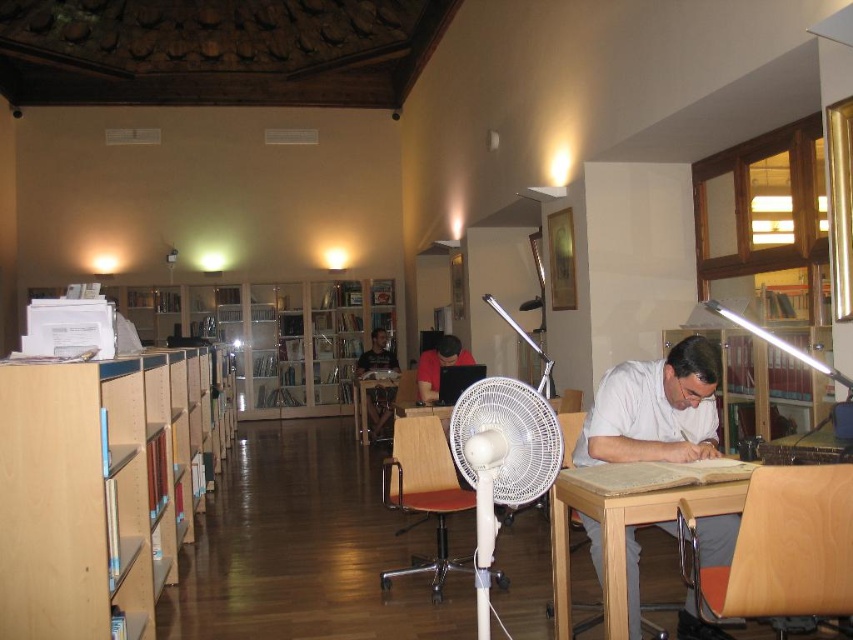
Measure the distance from light brown wood bookshelf at left to wooden bookcase at center.

light brown wood bookshelf at left and wooden bookcase at center are 25.43 feet apart from each other.

You are a GUI agent. You are given a task and a screenshot of the screen. Output one action in this format:
    pyautogui.click(x=<x>, y=<y>)
    Task: Click on the light brown wood bookshelf at left
    This screenshot has height=640, width=853.
    Given the screenshot: What is the action you would take?
    pyautogui.click(x=102, y=486)

Locate an element on the screen. The height and width of the screenshot is (640, 853). light brown wood bookshelf at left is located at coordinates (102, 486).

Does white plastic fan at center have a lesser height compared to dark blue shirt at center?

Indeed, white plastic fan at center has a lesser height compared to dark blue shirt at center.

Can you confirm if white plastic fan at center is taller than dark blue shirt at center?

No.

Between point (479, 381) and point (389, 412), which one is positioned in front?

Point (479, 381)

You are a GUI agent. You are given a task and a screenshot of the screen. Output one action in this format:
    pyautogui.click(x=<x>, y=<y>)
    Task: Click on the white plastic fan at center
    The width and height of the screenshot is (853, 640).
    Given the screenshot: What is the action you would take?
    tap(502, 461)

Who is lower down, light brown wood bookshelf at left or red matte shirt at center?

light brown wood bookshelf at left

Can you confirm if light brown wood bookshelf at left is positioned to the left of red matte shirt at center?

Correct, you'll find light brown wood bookshelf at left to the left of red matte shirt at center.

Between point (114, 609) and point (434, 380), which one is positioned in front?

Positioned in front is point (114, 609).

Identify the location of light brown wood bookshelf at left. This screenshot has width=853, height=640. [x=102, y=486].